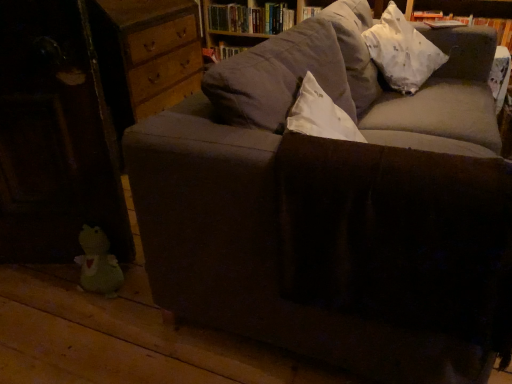
Identify the location of hardcover books at upper center, the 1th book in the back-to-front sequence. (250, 18).

In order to face green plush toy at lower left, should I rotate leftwards or rightwards?

A 21.958 degree turn to the left will do.

Describe the element at coordinates (98, 263) in the screenshot. I see `green plush toy at lower left` at that location.

Identify the location of white fabric pillow at upper right. Image resolution: width=512 pixels, height=384 pixels. 402,51.

Is hardcover books at upper center, placed as the first book when sorted from left to right, wider than green plush toy at lower left?

Correct, the width of hardcover books at upper center, placed as the first book when sorted from left to right, exceeds that of green plush toy at lower left.

Which object is more forward, hardcover books at upper center, placed as the first book when sorted from left to right, or green plush toy at lower left?

green plush toy at lower left is in front.

Is hardcover books at upper center, which is the 2th book from front to back, turned away from green plush toy at lower left?

No, hardcover books at upper center, which is the 2th book from front to back, is not facing the opposite direction of green plush toy at lower left.

From the green plush toy at lower left, count 1st book to the right and point to it. Please provide its 2D coordinates.

[(250, 18)]

Identify the location of the 2nd book counting from the right side of the green plush toy at lower left. The height and width of the screenshot is (384, 512). (471, 23).

From the picture: From a real-world perspective, which is physically above, green plush toy at lower left or white paper book at upper right, which is the first book from right to left?

white paper book at upper right, which is the first book from right to left, from a real-world perspective.

From the image's perspective, is green plush toy at lower left over white paper book at upper right, which is counted as the first book, starting from the front?

No.

Measure the distance from green plush toy at lower left to white paper book at upper right, marked as the 2th book in a back-to-front arrangement.

A distance of 2.05 meters exists between green plush toy at lower left and white paper book at upper right, marked as the 2th book in a back-to-front arrangement.

Does point (286, 8) come behind point (423, 38)?

Yes, point (286, 8) is farther from viewer.

Visually, is hardcover books at upper center, arranged as the second book when viewed from the right, positioned to the left or to the right of white fabric pillow at upper right?

hardcover books at upper center, arranged as the second book when viewed from the right, is to the left of white fabric pillow at upper right.

Are hardcover books at upper center, the 1th book in the back-to-front sequence, and white fabric pillow at upper right beside each other?

hardcover books at upper center, the 1th book in the back-to-front sequence, and white fabric pillow at upper right are not in contact.

From a real-world perspective, is hardcover books at upper center, arranged as the second book when viewed from the right, above or below white fabric pillow at upper right?

hardcover books at upper center, arranged as the second book when viewed from the right, is situated lower than white fabric pillow at upper right in the real world.

Looking at this image, is white fabric pillow at upper right at the back of green plush toy at lower left?

No, green plush toy at lower left is not facing away from white fabric pillow at upper right.

Between green plush toy at lower left and white fabric pillow at upper right, which one is positioned behind?

white fabric pillow at upper right is further away from the camera.

Considering the positions of objects green plush toy at lower left and white fabric pillow at upper right in the image provided, who is more to the right, green plush toy at lower left or white fabric pillow at upper right?

From the viewer's perspective, white fabric pillow at upper right appears more on the right side.

Can you see green plush toy at lower left touching white fabric pillow at upper right?

green plush toy at lower left is not next to white fabric pillow at upper right, and they're not touching.

Can hardcover books at upper center, the 1th book in the back-to-front sequence, be found inside green plush toy at lower left?

No, hardcover books at upper center, the 1th book in the back-to-front sequence, is not surrounded by green plush toy at lower left.

Considering the points (81, 258) and (250, 12), which point is behind, point (81, 258) or point (250, 12)?

The point (250, 12) is more distant.

Consider the image. From a real-world perspective, which is physically below, green plush toy at lower left or hardcover books at upper center, which is the 2th book from front to back?

green plush toy at lower left.

In the scene shown: How many degrees apart are the facing directions of green plush toy at lower left and hardcover books at upper center, the 1th book in the back-to-front sequence?

22.9 degrees.

Is hardcover books at upper center, placed as the first book when sorted from left to right, next to white paper book at upper right, marked as the 2th book in a back-to-front arrangement?

No, hardcover books at upper center, placed as the first book when sorted from left to right, is not touching white paper book at upper right, marked as the 2th book in a back-to-front arrangement.

Is point (258, 14) less distant than point (457, 16)?

No, it is not.

Looking at this image, from a real-world perspective, is hardcover books at upper center, placed as the first book when sorted from left to right, under white paper book at upper right, which is the first book from right to left?

No.

Which object is more forward, hardcover books at upper center, arranged as the second book when viewed from the right, or white paper book at upper right, the 2th book positioned from the left?

white paper book at upper right, the 2th book positioned from the left.

This screenshot has height=384, width=512. In order to click on throw pillow above the green plush toy at lower left (from the image's perspective) in this screenshot , I will do `click(402, 51)`.

From a real-world perspective, which is physically below, white fabric pillow at upper right or green plush toy at lower left?

green plush toy at lower left.

From the image's perspective, which is above, white fabric pillow at upper right or green plush toy at lower left?

From the image's view, white fabric pillow at upper right is above.

Where is `toy in front of the hardcover books at upper center, placed as the first book when sorted from left to right`? toy in front of the hardcover books at upper center, placed as the first book when sorted from left to right is located at coordinates (98, 263).

Identify the location of book that is the 2nd one when counting rightward from the green plush toy at lower left. This screenshot has height=384, width=512. (471, 23).

When comparing their distances from white fabric pillow at upper right, does green plush toy at lower left or hardcover books at upper center, which is the 2th book from front to back, seem further?

Among the two, green plush toy at lower left is located further to white fabric pillow at upper right.

Looking at this image, estimate the real-world distances between objects in this image. Which object is closer to hardcover books at upper center, placed as the first book when sorted from left to right, white fabric pillow at upper right or white paper book at upper right, marked as the 2th book in a back-to-front arrangement?

Based on the image, white paper book at upper right, marked as the 2th book in a back-to-front arrangement, appears to be nearer to hardcover books at upper center, placed as the first book when sorted from left to right.

Based on their spatial positions, is white paper book at upper right, marked as the 2th book in a back-to-front arrangement, or green plush toy at lower left further from hardcover books at upper center, placed as the first book when sorted from left to right?

The object further to hardcover books at upper center, placed as the first book when sorted from left to right, is green plush toy at lower left.

Considering their positions, is hardcover books at upper center, placed as the first book when sorted from left to right, positioned closer to green plush toy at lower left than white fabric pillow at upper right?

white fabric pillow at upper right.

Based on their spatial positions, is white fabric pillow at upper right or hardcover books at upper center, arranged as the second book when viewed from the right, further from green plush toy at lower left?

hardcover books at upper center, arranged as the second book when viewed from the right.

Which object lies nearer to the anchor point white fabric pillow at upper right, hardcover books at upper center, arranged as the second book when viewed from the right, or green plush toy at lower left?

Based on the image, hardcover books at upper center, arranged as the second book when viewed from the right, appears to be nearer to white fabric pillow at upper right.

Based on their spatial positions, is white paper book at upper right, the 2th book positioned from the left, or white fabric pillow at upper right further from green plush toy at lower left?

white paper book at upper right, the 2th book positioned from the left, is further to green plush toy at lower left.

Based on the photo, considering their positions, is white paper book at upper right, which is the first book from right to left, positioned further to white fabric pillow at upper right than hardcover books at upper center, arranged as the second book when viewed from the right?

hardcover books at upper center, arranged as the second book when viewed from the right, lies further to white fabric pillow at upper right than the other object.

Locate an element on the screen. The height and width of the screenshot is (384, 512). throw pillow located between hardcover books at upper center, placed as the first book when sorted from left to right, and white paper book at upper right, the 2th book positioned from the left, in the left-right direction is located at coordinates (402, 51).

I want to click on book between green plush toy at lower left and white paper book at upper right, the 2th book positioned from the left, so click(250, 18).

I want to click on throw pillow between green plush toy at lower left and white paper book at upper right, which is the first book from right to left, from left to right, so click(402, 51).

Identify the location of throw pillow positioned between green plush toy at lower left and hardcover books at upper center, arranged as the second book when viewed from the right, from near to far. (402, 51).